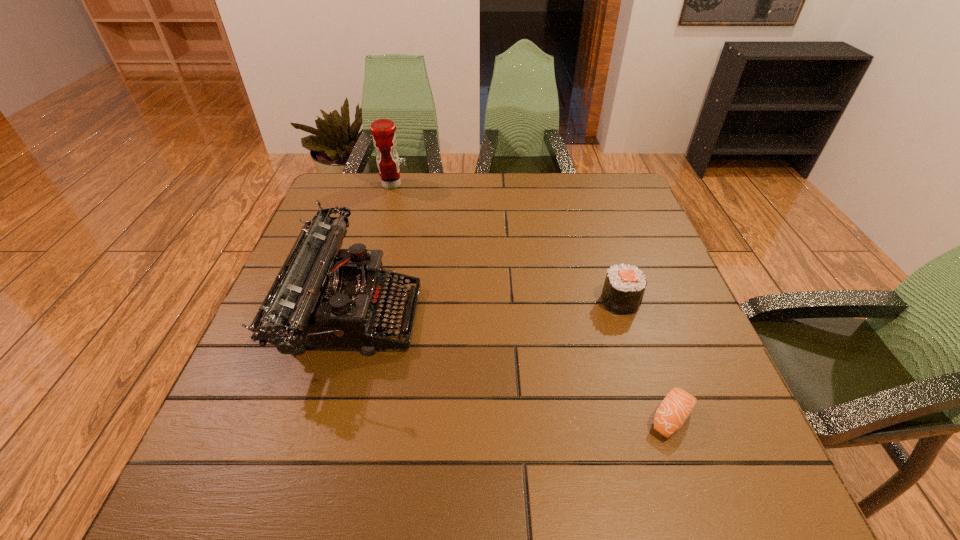
Locate an element on the screen. This screenshot has height=540, width=960. free space between the taller sushi and the farthest object is located at coordinates (506, 243).

Identify which object is the second closest to the typewriter. Please provide its 2D coordinates. Your answer should be formatted as a tuple, i.e. [(x, y)], where the tuple contains the x and y coordinates of a point satisfying the conditions above.

[(624, 286)]

Where is `object that ranks as the second closest to the third tallest object`? This screenshot has width=960, height=540. object that ranks as the second closest to the third tallest object is located at coordinates (323, 296).

Locate an element on the screen. free space that satisfies the following two spatial constraints: 1. on the front side of the farthest object; 2. on the keyboard of the second tallest object is located at coordinates (356, 313).

Where is `vacant space that satisfies the following two spatial constraints: 1. on the front side of the farthest object; 2. on the left side of the shorter sushi`? Image resolution: width=960 pixels, height=540 pixels. vacant space that satisfies the following two spatial constraints: 1. on the front side of the farthest object; 2. on the left side of the shorter sushi is located at coordinates (327, 418).

The width and height of the screenshot is (960, 540). Find the location of `free space that satisfies the following two spatial constraints: 1. on the front side of the third tallest object; 2. on the left side of the farthest object`. free space that satisfies the following two spatial constraints: 1. on the front side of the third tallest object; 2. on the left side of the farthest object is located at coordinates (360, 301).

What are the coordinates of `free space that satisfies the following two spatial constraints: 1. on the front side of the condiment; 2. on the keyboard of the second tallest object` in the screenshot? It's located at (356, 313).

Locate an element on the screen. The height and width of the screenshot is (540, 960). blank area in the image that satisfies the following two spatial constraints: 1. on the front side of the farther sushi; 2. on the left side of the farthest object is located at coordinates (360, 301).